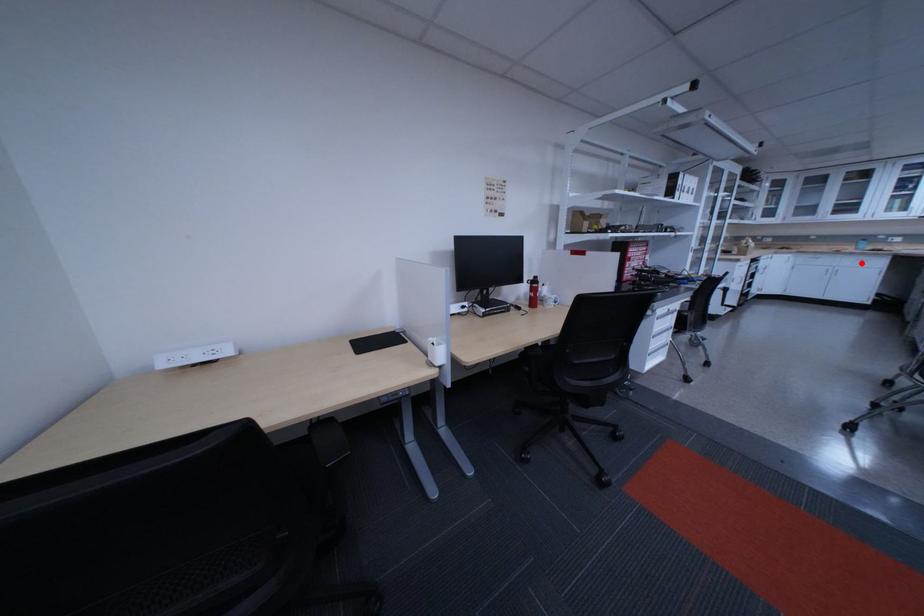
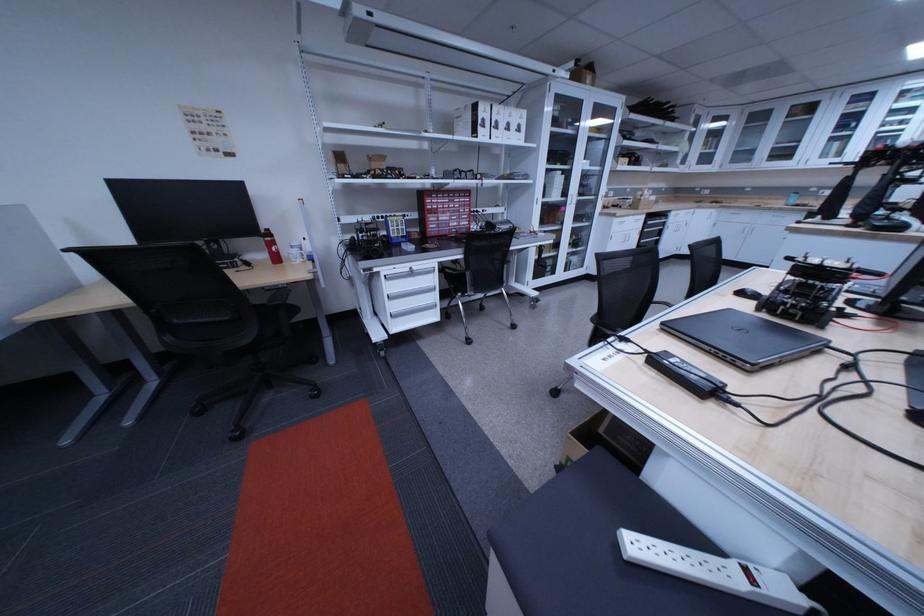
Find the pixel in the second image that matches the highlighted location in the first image.

(779, 220)